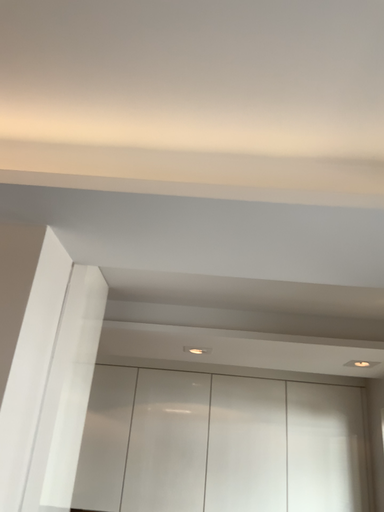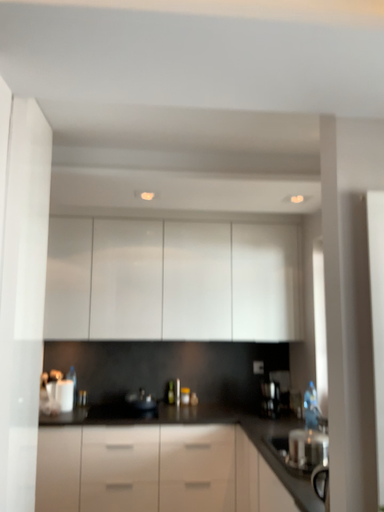
Question: Which way did the camera rotate in the video?

Choices:
 (A) rotated right
 (B) rotated left

Answer: (A)